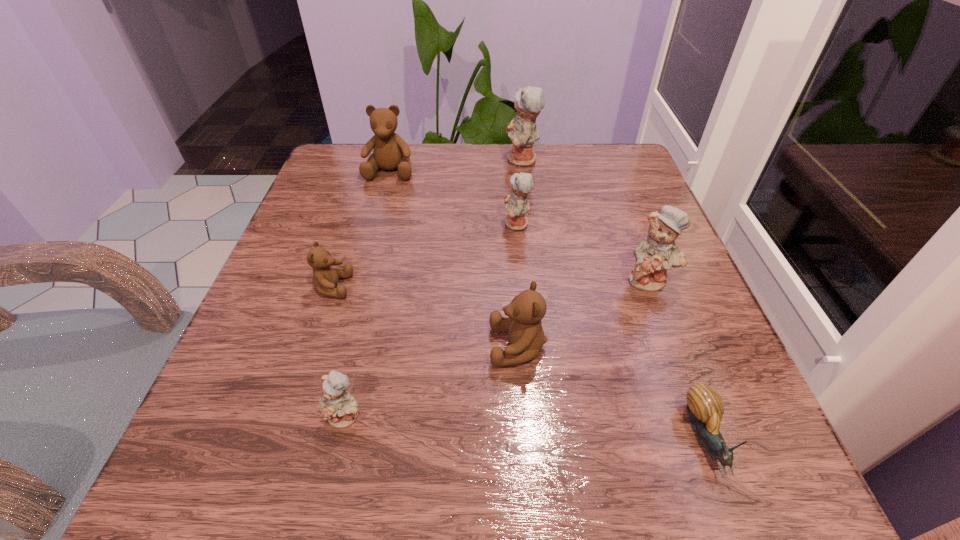
What are the coordinates of `vacant space that is in between the second nearest brown teddy bear and the nearest teddy bear` in the screenshot? It's located at (339, 352).

At what (x,y) coordinates should I click in order to perform the action: click on vacant area that lies between the leftmost blue teddy bear and the sixth farthest object. Please return your answer as a coordinate pair (x, y). The height and width of the screenshot is (540, 960). Looking at the image, I should click on (432, 381).

Locate an element on the screen. Image resolution: width=960 pixels, height=540 pixels. empty location between the smallest blue teddy bear and the second farthest blue teddy bear is located at coordinates [x=431, y=320].

You are a GUI agent. You are given a task and a screenshot of the screen. Output one action in this format:
    pyautogui.click(x=<x>, y=<y>)
    Task: Click on the free spot between the leftmost blue teddy bear and the second nearest brown teddy bear
    Image resolution: width=960 pixels, height=540 pixels.
    Given the screenshot: What is the action you would take?
    pyautogui.click(x=339, y=352)

Identify the location of unoccupied area between the sixth farthest teddy bear and the smallest brown teddy bear. This screenshot has width=960, height=540. (425, 316).

In order to click on the second closest object to the nearest teddy bear in this screenshot , I will do `click(325, 278)`.

Identify which object is the closest to the escargot. Please provide its 2D coordinates. Your answer should be formatted as a tuple, i.e. [(x, y)], where the tuple contains the x and y coordinates of a point satisfying the conditions above.

[(526, 337)]

Identify the location of teddy bear that stands as the fifth closest to the second farthest blue teddy bear. point(325,278).

This screenshot has height=540, width=960. I want to click on teddy bear that is the sixth closest to the smallest blue teddy bear, so click(x=522, y=131).

Identify the location of blue teddy bear that is the fourth closest to the biggest brown teddy bear. (339, 407).